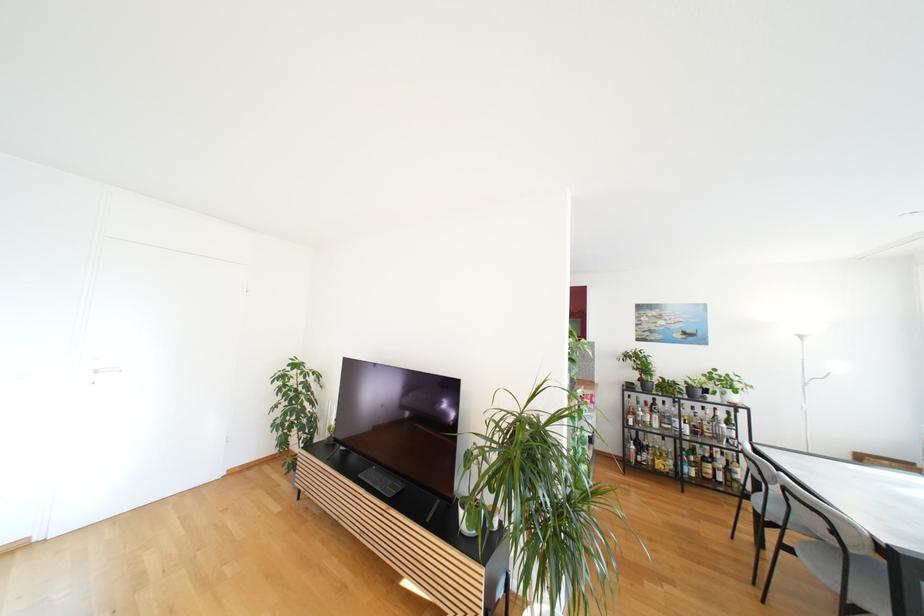
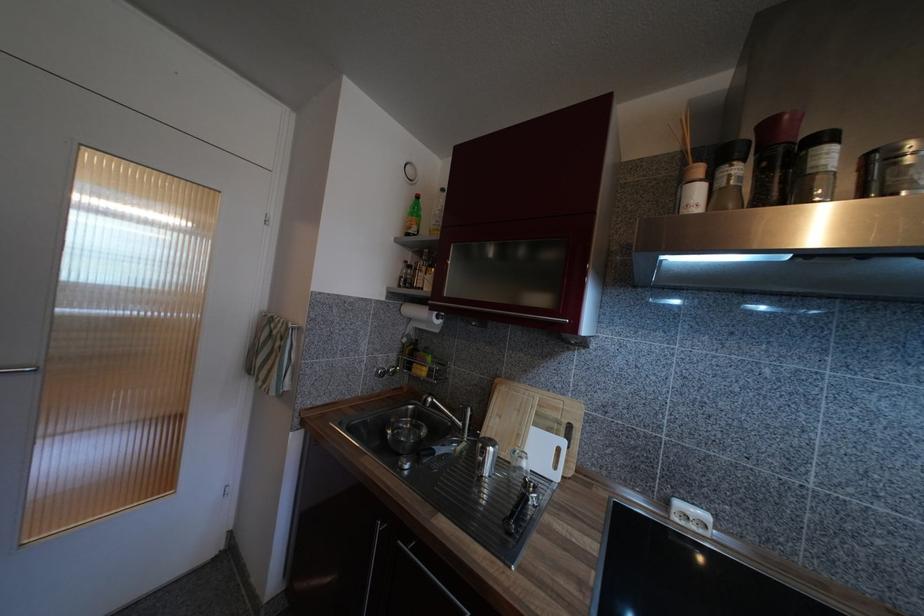
Question: In a continuous first-person perspective shot, in which direction is the camera moving?

Choices:
 (A) Left
 (B) Right
 (C) Forward
 (D) Backward

Answer: (C)